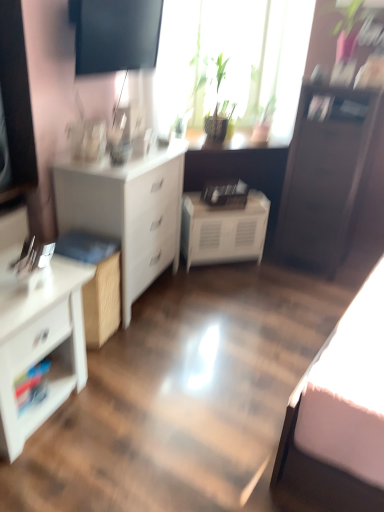
Question: Should I look upward or downward to see white glossy shelf at lower left?

Choices:
 (A) up
 (B) down

Answer: (B)

Question: Does green leafy plant at upper center turn towards dark wood file cabinet at right?

Choices:
 (A) no
 (B) yes

Answer: (B)

Question: Is dark wood file cabinet at right a part of green leafy plant at upper center?

Choices:
 (A) yes
 (B) no

Answer: (B)

Question: From the image's perspective, is green leafy plant at upper center over dark wood file cabinet at right?

Choices:
 (A) yes
 (B) no

Answer: (A)

Question: Is there a large distance between green leafy plant at upper center and dark wood file cabinet at right?

Choices:
 (A) yes
 (B) no

Answer: (B)

Question: From a real-world perspective, is green leafy plant at upper center physically above dark wood file cabinet at right?

Choices:
 (A) no
 (B) yes

Answer: (B)

Question: Is green leafy plant at upper center to the left of dark wood file cabinet at right from the viewer's perspective?

Choices:
 (A) yes
 (B) no

Answer: (A)

Question: Does white glossy shelf at lower left lie behind white glossy chest of drawers at left, acting as the first chest of drawers starting from the front?

Choices:
 (A) yes
 (B) no

Answer: (A)

Question: Considering the relative sizes of white glossy shelf at lower left and white glossy chest of drawers at left, acting as the first chest of drawers starting from the front, in the image provided, is white glossy shelf at lower left taller than white glossy chest of drawers at left, acting as the first chest of drawers starting from the front,?

Choices:
 (A) yes
 (B) no

Answer: (B)

Question: From a real-world perspective, is white glossy shelf at lower left on white glossy chest of drawers at left, the 2th chest of drawers positioned from the back?

Choices:
 (A) no
 (B) yes

Answer: (A)

Question: Does white glossy shelf at lower left contain white glossy chest of drawers at left, acting as the first chest of drawers starting from the front?

Choices:
 (A) no
 (B) yes

Answer: (A)

Question: Does white glossy shelf at lower left appear on the right side of white glossy chest of drawers at left, the 2th chest of drawers positioned from the back?

Choices:
 (A) no
 (B) yes

Answer: (A)

Question: Considering the relative sizes of white glossy shelf at lower left and white glossy chest of drawers at left, the 2th chest of drawers positioned from the back, in the image provided, is white glossy shelf at lower left wider than white glossy chest of drawers at left, the 2th chest of drawers positioned from the back,?

Choices:
 (A) no
 (B) yes

Answer: (A)

Question: Is white glossy chest of drawers at left, the 2th chest of drawers positioned from the back, at the left side of dark wood file cabinet at right?

Choices:
 (A) no
 (B) yes

Answer: (B)